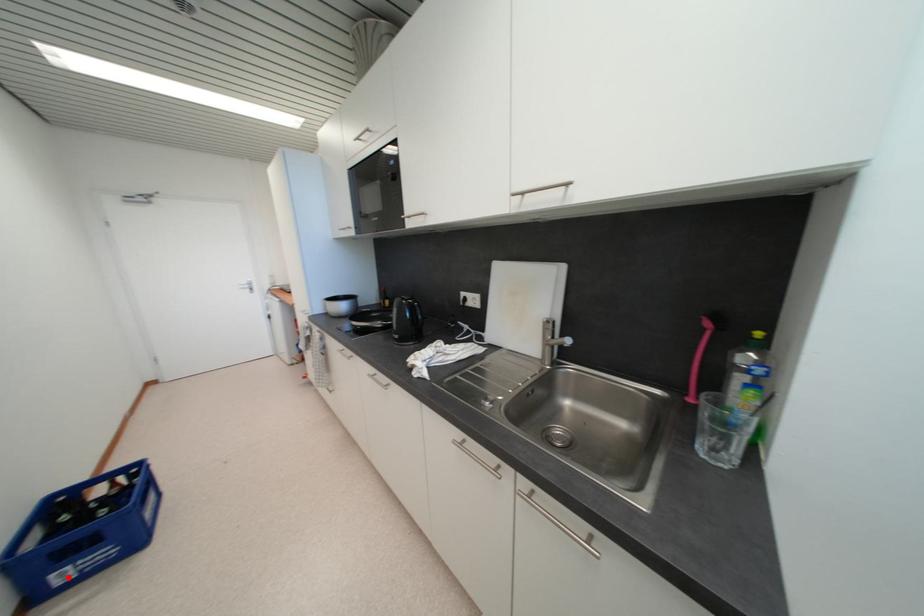
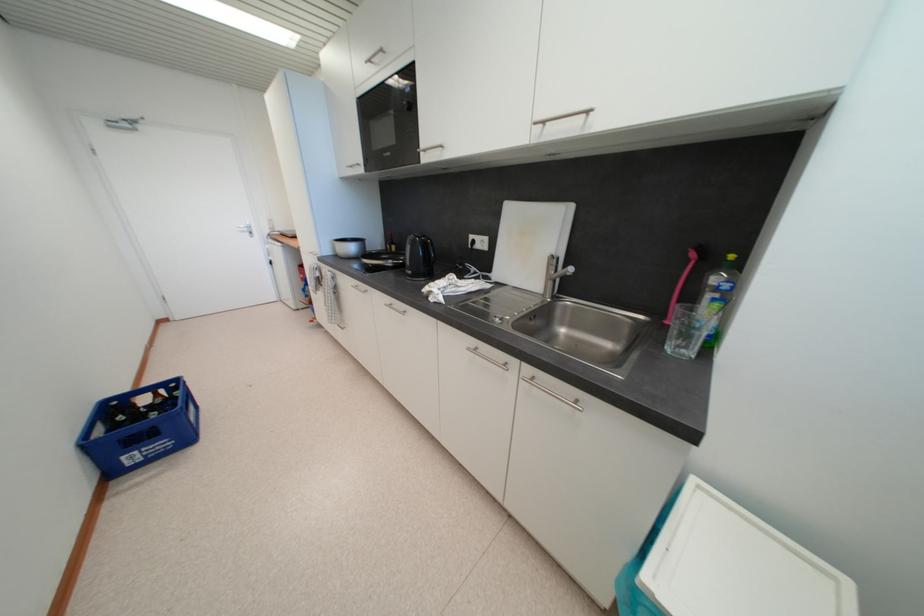
The point at the highlighted location is marked in the first image. Where is the corresponding point in the second image?

(138, 460)